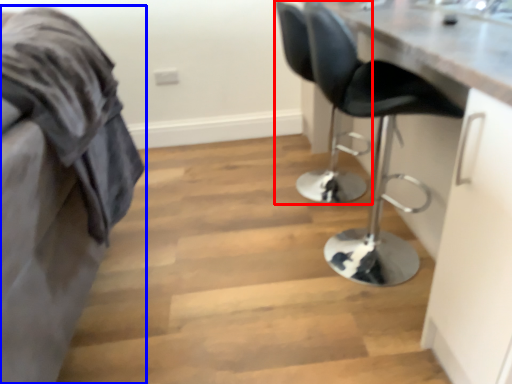
Question: Which object appears closest to the camera in this image, chair (highlighted by a red box) or furniture (highlighted by a blue box)?

Choices:
 (A) chair
 (B) furniture

Answer: (B)